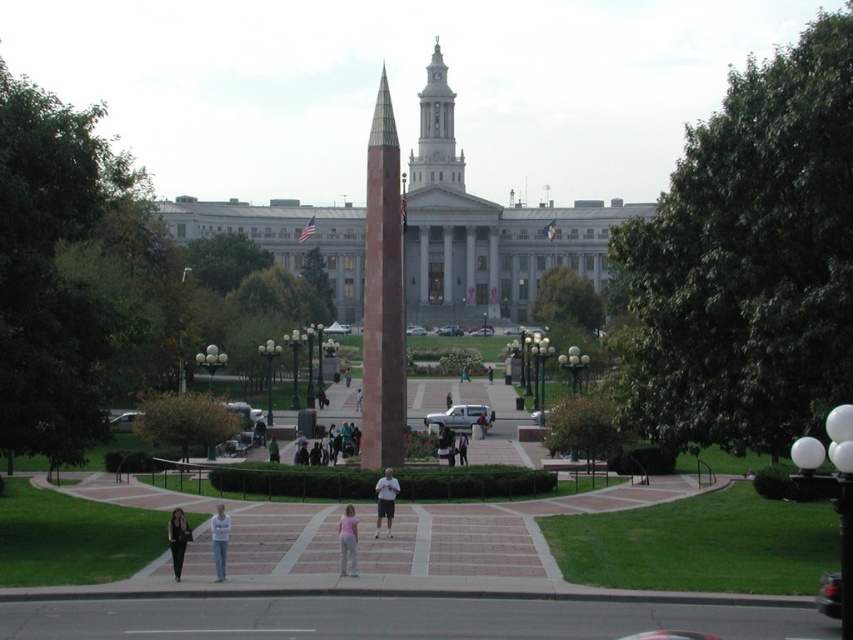
Question: Does white t-shirt at center have a greater width compared to green fabric jacket at center?

Choices:
 (A) yes
 (B) no

Answer: (A)

Question: Can you confirm if white stone bell tower at upper center is smaller than green fabric jacket at center?

Choices:
 (A) yes
 (B) no

Answer: (B)

Question: Estimate the real-world distances between objects in this image. Which object is closer to the white t-shirt at center?

Choices:
 (A) brown polished stone obelisk at center
 (B) black leather pants at lower left
 (C) green fabric jacket at center

Answer: (B)

Question: Among these points, which one is nearest to the camera?

Choices:
 (A) (271, 456)
 (B) (457, 173)

Answer: (A)

Question: Which point is farther to the camera?

Choices:
 (A) pink fabric pants at center
 (B) green fabric jacket at center

Answer: (B)

Question: Is light blue jeans at center thinner than green fabric jacket at center?

Choices:
 (A) yes
 (B) no

Answer: (A)